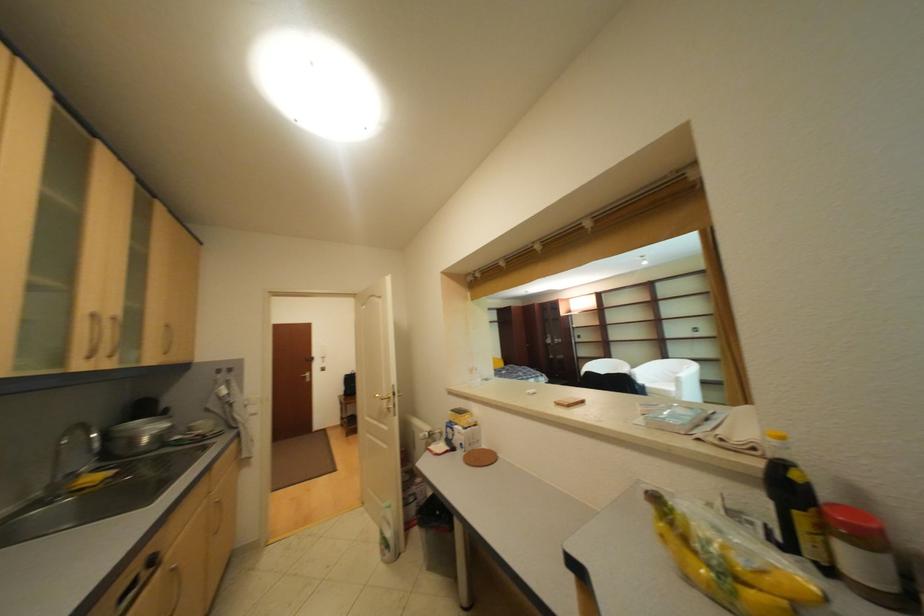
The image size is (924, 616). What do you see at coordinates (671, 379) in the screenshot? I see `the white chair sitting surface` at bounding box center [671, 379].